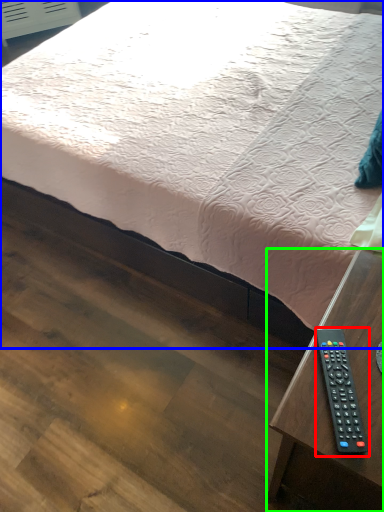
Question: Based on their relative distances, which object is nearer to remote control (highlighted by a red box)? Choose from bed (highlighted by a blue box) and table (highlighted by a green box).

Choices:
 (A) bed
 (B) table

Answer: (B)